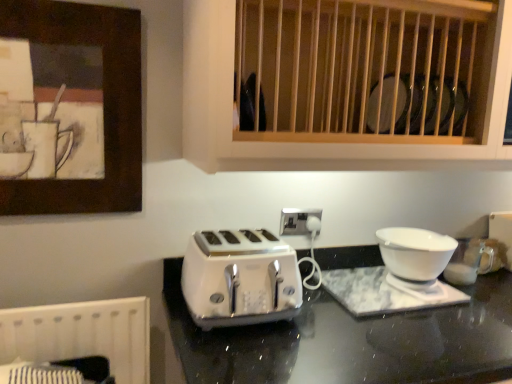
Describe the element at coordinates (104, 107) in the screenshot. I see `wooden picture frame at upper left` at that location.

What is the approximate height of wooden slats at upper center?

22.62 inches.

This screenshot has height=384, width=512. I want to click on white glossy bowl at right, so click(415, 252).

Locate an element on the screen. white glossy toaster at center is located at coordinates (240, 278).

Can you confirm if white plastic electric outlet at center is smaller than wooden picture frame at upper left?

Correct, white plastic electric outlet at center occupies less space than wooden picture frame at upper left.

From the picture: In the image, is white plastic electric outlet at center on the left side or the right side of wooden picture frame at upper left?

Clearly, white plastic electric outlet at center is on the right of wooden picture frame at upper left in the image.

Does white plastic electric outlet at center lie behind wooden picture frame at upper left?

A: Yes, it is behind wooden picture frame at upper left.

Considering the sizes of white glossy bowl at right and white glossy toaster at center in the image, is white glossy bowl at right wider or thinner than white glossy toaster at center?

Clearly, white glossy bowl at right has less width compared to white glossy toaster at center.

Can you tell me how much white glossy bowl at right and white glossy toaster at center differ in facing direction?

white glossy bowl at right and white glossy toaster at center are facing 2.25 degrees away from each other.

Who is bigger, white glossy bowl at right or white glossy toaster at center?

Bigger between the two is white glossy toaster at center.

How much distance is there between white glossy bowl at right and wooden slats at upper center?

white glossy bowl at right is 18.58 inches away from wooden slats at upper center.

How many degrees apart are the facing directions of white glossy bowl at right and wooden slats at upper center?

The angle between the facing direction of white glossy bowl at right and the facing direction of wooden slats at upper center is 0.336 degrees.

Does white glossy bowl at right turn towards wooden slats at upper center?

No, white glossy bowl at right is not facing towards wooden slats at upper center.

Who is smaller, white glossy bowl at right or wooden slats at upper center?

white glossy bowl at right.

Can you confirm if wooden slats at upper center is thinner than white glossy toaster at center?

No.

Between point (185, 118) and point (193, 251), which one is positioned in front?

The point (193, 251) is closer.

In the image, is wooden slats at upper center positioned in front of or behind white glossy toaster at center?

Visually, wooden slats at upper center is located in front of white glossy toaster at center.

How far apart are wooden slats at upper center and white glossy toaster at center?

wooden slats at upper center is 13.40 inches from white glossy toaster at center.

Between white glossy toaster at center and wooden slats at upper center, which one has smaller size?

white glossy toaster at center.

Which object is closer to the camera, white glossy toaster at center or wooden slats at upper center?

Positioned in front is wooden slats at upper center.

From their relative heights in the image, would you say white glossy toaster at center is taller or shorter than wooden slats at upper center?

Considering their sizes, white glossy toaster at center has less height than wooden slats at upper center.

Locate an element on the screen. toaster below the wooden slats at upper center (from a real-world perspective) is located at coordinates (240, 278).

At what (x,y) coordinates should I click in order to perform the action: click on cabinetry in front of the white plastic electric outlet at center. Please return your answer as a coordinate pair (x, y). Looking at the image, I should click on (308, 143).

Relative to wooden slats at upper center, is white plastic electric outlet at center in front or behind?

white plastic electric outlet at center is behind wooden slats at upper center.

Is white plastic electric outlet at center to the right of wooden slats at upper center from the viewer's perspective?

In fact, white plastic electric outlet at center is to the left of wooden slats at upper center.

Which of these two, white plastic electric outlet at center or wooden slats at upper center, is thinner?

white plastic electric outlet at center is thinner.

Which object is wider, white glossy toaster at center or white plastic electric outlet at center?

With larger width is white glossy toaster at center.

Consider the image. Who is taller, white glossy toaster at center or white plastic electric outlet at center?

white glossy toaster at center.

Is point (267, 268) in front of point (311, 213)?

Yes, point (267, 268) is closer to viewer.

Based on the photo, from a real-world perspective, is white glossy toaster at center beneath white plastic electric outlet at center?

Yes, from a real-world perspective, white glossy toaster at center is under white plastic electric outlet at center.

This screenshot has width=512, height=384. In order to click on picture frame lying in front of the white plastic electric outlet at center in this screenshot , I will do click(x=104, y=107).

Locate an element on the screen. Image resolution: width=512 pixels, height=384 pixels. toaster beneath the white glossy bowl at right (from a real-world perspective) is located at coordinates (240, 278).

Based on their spatial positions, is wooden slats at upper center or white plastic electric outlet at center further from wooden picture frame at upper left?

The object further to wooden picture frame at upper left is white plastic electric outlet at center.

Which object lies nearer to the anchor point white plastic electric outlet at center, white glossy bowl at right or white glossy toaster at center?

Based on the image, white glossy toaster at center appears to be nearer to white plastic electric outlet at center.

From the picture: Estimate the real-world distances between objects in this image. Which object is further from wooden picture frame at upper left, white plastic electric outlet at center or wooden slats at upper center?

white plastic electric outlet at center is further to wooden picture frame at upper left.

Estimate the real-world distances between objects in this image. Which object is further from wooden picture frame at upper left, wooden slats at upper center or white glossy toaster at center?

white glossy toaster at center.

From the image, which object appears to be farther from white glossy toaster at center, wooden slats at upper center or wooden picture frame at upper left?

wooden picture frame at upper left.

Considering their positions, is wooden slats at upper center positioned closer to white plastic electric outlet at center than wooden picture frame at upper left?

The object closer to white plastic electric outlet at center is wooden slats at upper center.

Which object lies nearer to the anchor point white glossy bowl at right, wooden slats at upper center or white glossy toaster at center?

wooden slats at upper center is positioned closer to the anchor white glossy bowl at right.

Which object lies nearer to the anchor point wooden slats at upper center, white glossy bowl at right or wooden picture frame at upper left?

wooden picture frame at upper left is closer to wooden slats at upper center.

Find the location of a particular element. The height and width of the screenshot is (384, 512). kitchen appliance between wooden slats at upper center and white glossy toaster at center vertically is located at coordinates (415, 252).

Identify the location of electric outlet between wooden picture frame at upper left and wooden slats at upper center in the horizontal direction. (297, 221).

Find the location of `electric outlet between wooden picture frame at upper left and white glossy bowl at right`. electric outlet between wooden picture frame at upper left and white glossy bowl at right is located at coordinates (297, 221).

At what (x,y) coordinates should I click in order to perform the action: click on electric outlet that lies between wooden slats at upper center and white glossy toaster at center from top to bottom. Please return your answer as a coordinate pair (x, y). The image size is (512, 384). Looking at the image, I should click on (297, 221).